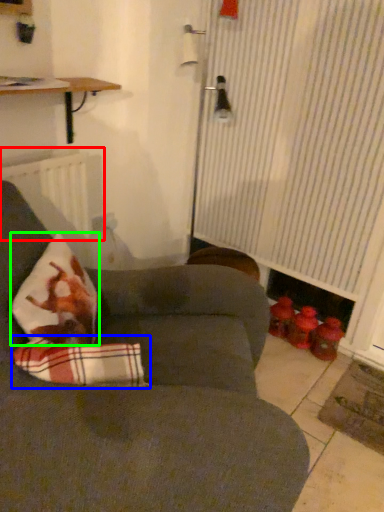
Question: Estimate the real-world distances between objects in this image. Which object is closer to radiator (highlighted by a red box), linen (highlighted by a blue box) or throw pillow (highlighted by a green box)?

Choices:
 (A) linen
 (B) throw pillow

Answer: (B)